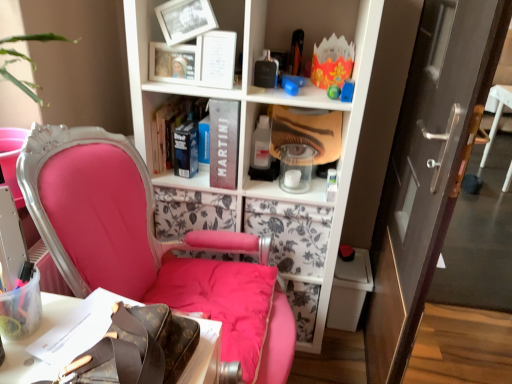
Question: From a real-world perspective, is hardcover book at center, which ranks as the first book in left-to-right order, below brown leather bag at lower left?

Choices:
 (A) no
 (B) yes

Answer: (A)

Question: Can you confirm if hardcover book at center, which ranks as the first book in left-to-right order, is shorter than brown leather bag at lower left?

Choices:
 (A) no
 (B) yes

Answer: (A)

Question: Can you confirm if hardcover book at center, which is counted as the second book, starting from the right, is thinner than brown leather bag at lower left?

Choices:
 (A) no
 (B) yes

Answer: (B)

Question: From the image's perspective, is hardcover book at center, which ranks as the first book in left-to-right order, located above brown leather bag at lower left?

Choices:
 (A) yes
 (B) no

Answer: (A)

Question: Considering the relative sizes of hardcover book at center, which is counted as the second book, starting from the right, and brown leather bag at lower left in the image provided, is hardcover book at center, which is counted as the second book, starting from the right, wider than brown leather bag at lower left?

Choices:
 (A) no
 (B) yes

Answer: (A)

Question: Is brown leather bag at lower left surrounded by hardcover book at center, which ranks as the first book in left-to-right order?

Choices:
 (A) yes
 (B) no

Answer: (B)

Question: From the image's perspective, is hardcover book at center, which ranks as the first book in left-to-right order, beneath matte black book at center, the 1th book in the right-to-left sequence?

Choices:
 (A) no
 (B) yes

Answer: (A)

Question: Can we say hardcover book at center, which ranks as the first book in left-to-right order, lies outside matte black book at center, the 1th book in the right-to-left sequence?

Choices:
 (A) yes
 (B) no

Answer: (A)

Question: Is matte black book at center, which is counted as the second book, starting from the left, at the back of hardcover book at center, which ranks as the first book in left-to-right order?

Choices:
 (A) yes
 (B) no

Answer: (B)

Question: From a real-world perspective, is hardcover book at center, which is counted as the second book, starting from the right, on top of matte black book at center, the 1th book in the right-to-left sequence?

Choices:
 (A) no
 (B) yes

Answer: (A)

Question: Would you say matte black book at center, the 1th book in the right-to-left sequence, is part of hardcover book at center, which is counted as the second book, starting from the right,'s contents?

Choices:
 (A) no
 (B) yes

Answer: (A)

Question: Is hardcover book at center, which ranks as the first book in left-to-right order, in contact with matte black book at center, which is counted as the second book, starting from the left?

Choices:
 (A) yes
 (B) no

Answer: (B)

Question: Are matte black book at center, which is counted as the second book, starting from the left, and brown leather bag at lower left far apart?

Choices:
 (A) yes
 (B) no

Answer: (B)